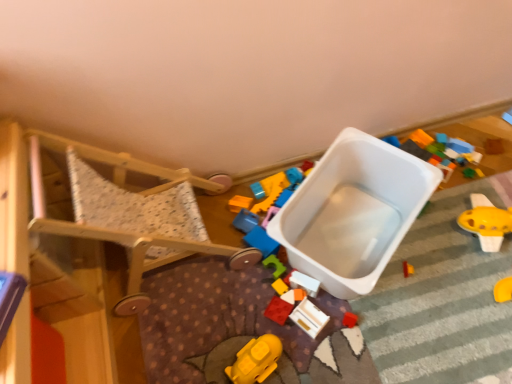
Question: Is rubberized red block at center, which appears as the fifth toy when viewed from the right, completely or partially outside of wooden toy at center, which appears as the fifth toy when viewed from the left?

Choices:
 (A) no
 (B) yes

Answer: (B)

Question: Is wooden toy at center, the second toy in the right-to-left sequence, completely or partially inside rubberized red block at center, which is counted as the second toy, starting from the left?

Choices:
 (A) no
 (B) yes

Answer: (A)

Question: From a real-world perspective, does rubberized red block at center, which appears as the fifth toy when viewed from the right, stand above wooden toy at center, which appears as the fifth toy when viewed from the left?

Choices:
 (A) yes
 (B) no

Answer: (B)

Question: Does rubberized red block at center, which appears as the fifth toy when viewed from the right, come in front of wooden toy at center, which appears as the fifth toy when viewed from the left?

Choices:
 (A) no
 (B) yes

Answer: (A)

Question: Can you confirm if rubberized red block at center, which appears as the fifth toy when viewed from the right, is positioned to the left of wooden toy at center, the second toy in the right-to-left sequence?

Choices:
 (A) no
 (B) yes

Answer: (B)

Question: Is rubberized red block at center, which is counted as the second toy, starting from the left, taller than wooden toy at center, which appears as the fifth toy when viewed from the left?

Choices:
 (A) no
 (B) yes

Answer: (A)

Question: From the image's perspective, is white plastic storage box at center located beneath white plastic toy at center, which ranks as the fourth toy in left-to-right order?

Choices:
 (A) yes
 (B) no

Answer: (B)

Question: Does white plastic storage box at center have a greater width compared to white plastic toy at center, the 3th toy positioned from the right?

Choices:
 (A) yes
 (B) no

Answer: (A)

Question: Does white plastic storage box at center lie in front of white plastic toy at center, the 3th toy positioned from the right?

Choices:
 (A) yes
 (B) no

Answer: (A)

Question: Can you confirm if white plastic storage box at center is taller than white plastic toy at center, the 3th toy positioned from the right?

Choices:
 (A) no
 (B) yes

Answer: (B)

Question: From the image's perspective, is white plastic storage box at center on top of white plastic toy at center, which ranks as the fourth toy in left-to-right order?

Choices:
 (A) yes
 (B) no

Answer: (A)

Question: Does white plastic storage box at center have a lesser width compared to white plastic toy at center, the 3th toy positioned from the right?

Choices:
 (A) no
 (B) yes

Answer: (A)

Question: Can you confirm if yellow plastic toy at right, which is counted as the first toy, starting from the right, is smaller than yellow matte toy at lower center, which is counted as the first toy, starting from the left?

Choices:
 (A) yes
 (B) no

Answer: (B)